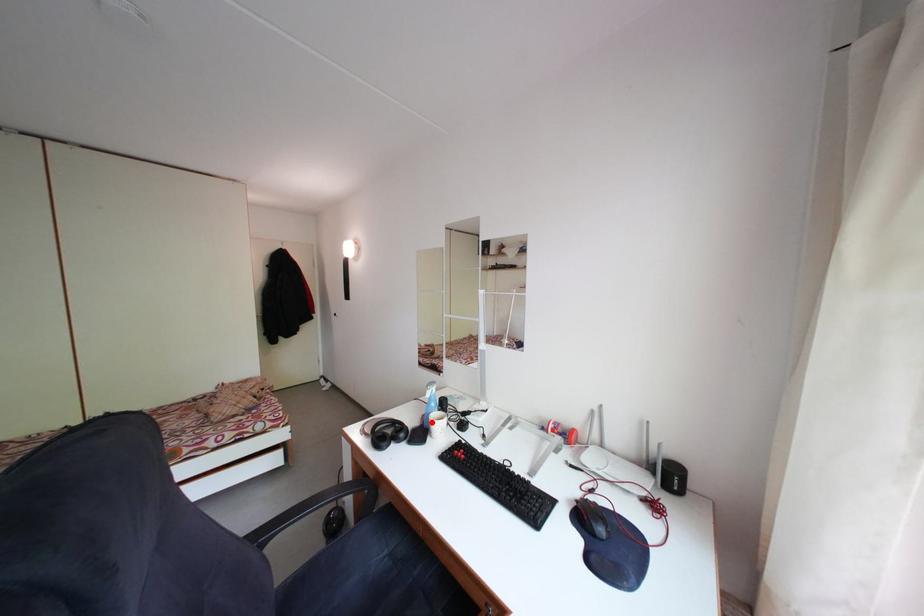
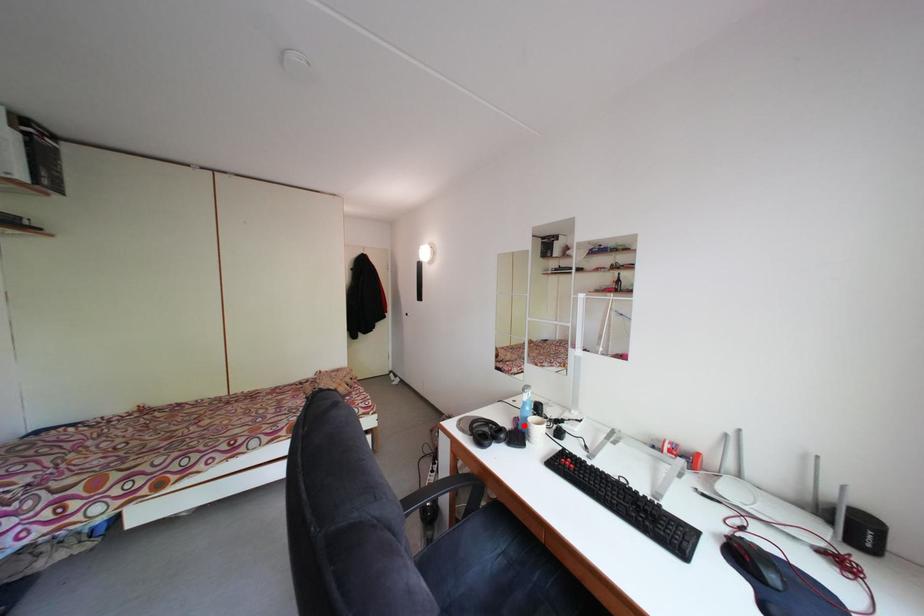
I am providing you with two images of the same scene from different viewpoints. A red point is marked on the first image and another point is marked on the second image. Is the marked point in image1 the same physical position as the marked point in image2?

Yes